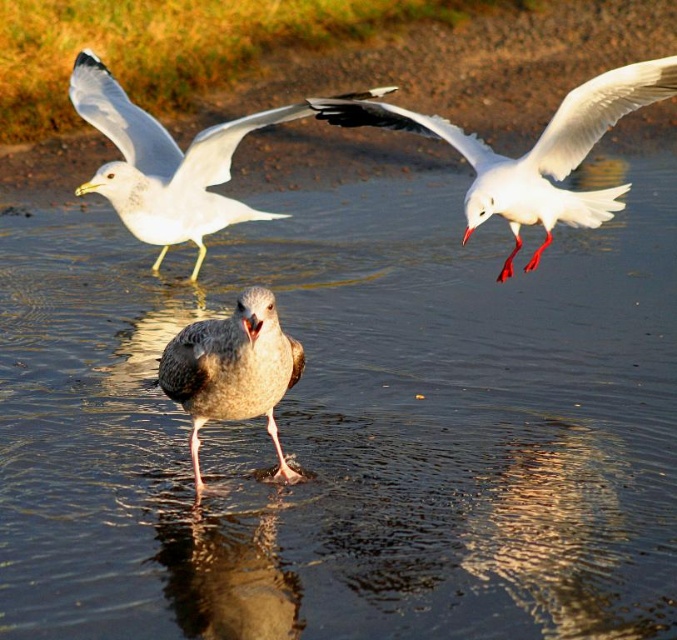
Does white glossy seagull at upper right appear on the right side of gray feathered bird at center?

Indeed, white glossy seagull at upper right is positioned on the right side of gray feathered bird at center.

Is white glossy seagull at upper right taller than gray feathered bird at center?

Yes, white glossy seagull at upper right is taller than gray feathered bird at center.

Does point (609, 196) come behind point (271, 321)?

Yes, point (609, 196) is farther from viewer.

Where is `white glossy seagull at upper right`? This screenshot has height=640, width=677. white glossy seagull at upper right is located at coordinates (529, 150).

Between white glossy seagull at upper right and white matte seagull at upper left, which one appears on the right side from the viewer's perspective?

white glossy seagull at upper right

Identify the location of white glossy seagull at upper right. The image size is (677, 640). (529, 150).

Is point (508, 164) closer to viewer compared to point (112, 134)?

Yes.

Find the location of a particular element. This screenshot has height=640, width=677. white glossy seagull at upper right is located at coordinates (529, 150).

Is point (185, 173) positioned behind point (286, 380)?

That is True.

Can you confirm if white matte seagull at upper left is shorter than gray feathered bird at center?

In fact, white matte seagull at upper left may be taller than gray feathered bird at center.

Is point (169, 147) more distant than point (261, 304)?

Yes.

You are a GUI agent. You are given a task and a screenshot of the screen. Output one action in this format:
    pyautogui.click(x=<x>, y=<y>)
    Task: Click on the white matte seagull at upper left
    The width and height of the screenshot is (677, 640).
    Given the screenshot: What is the action you would take?
    pyautogui.click(x=165, y=163)